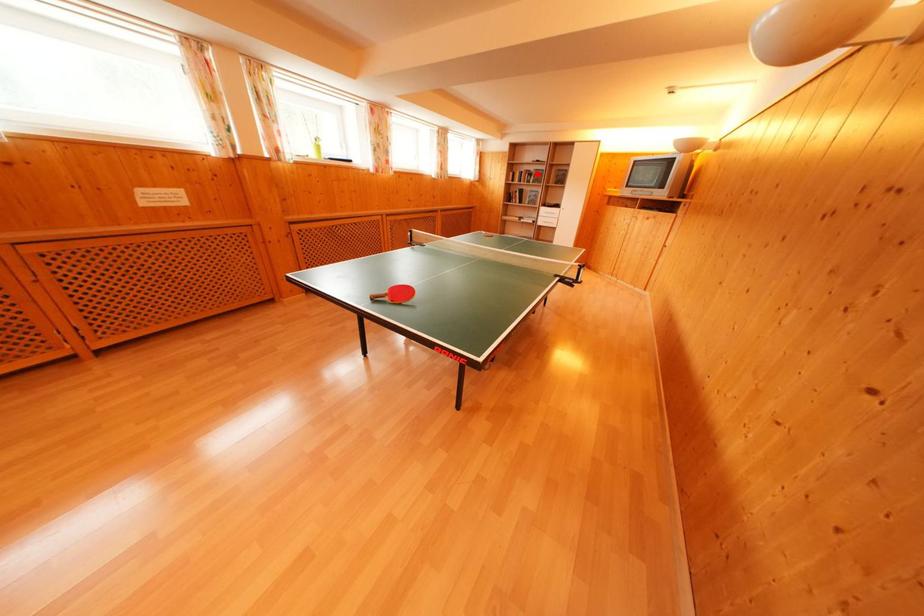
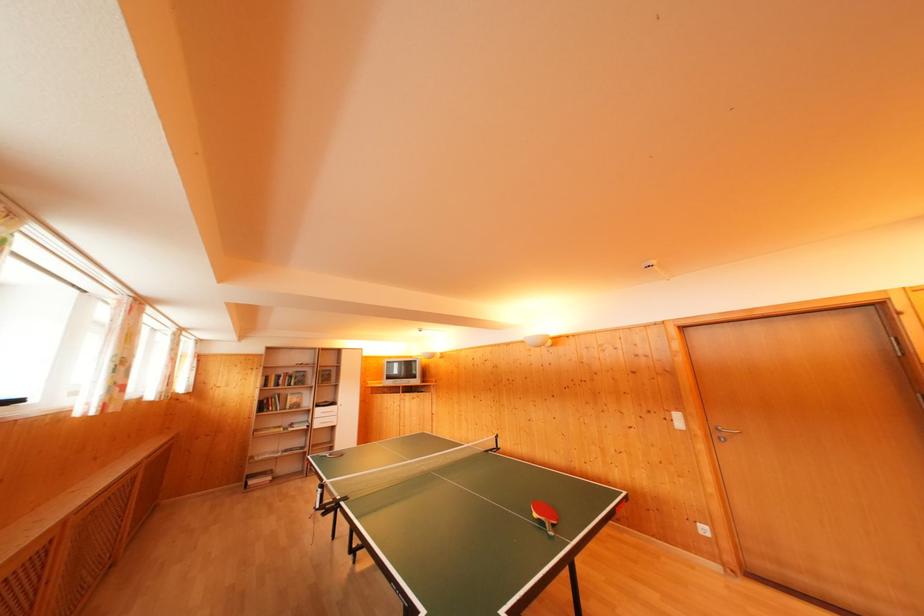
Question: I am providing you with two images of the same scene from different viewpoints. Image1 has a red point marked. In image2, the corresponding 3D location appears at what relative position? Reply with the corresponding letter.

Choices:
 (A) Closer
 (B) Farther

Answer: (B)